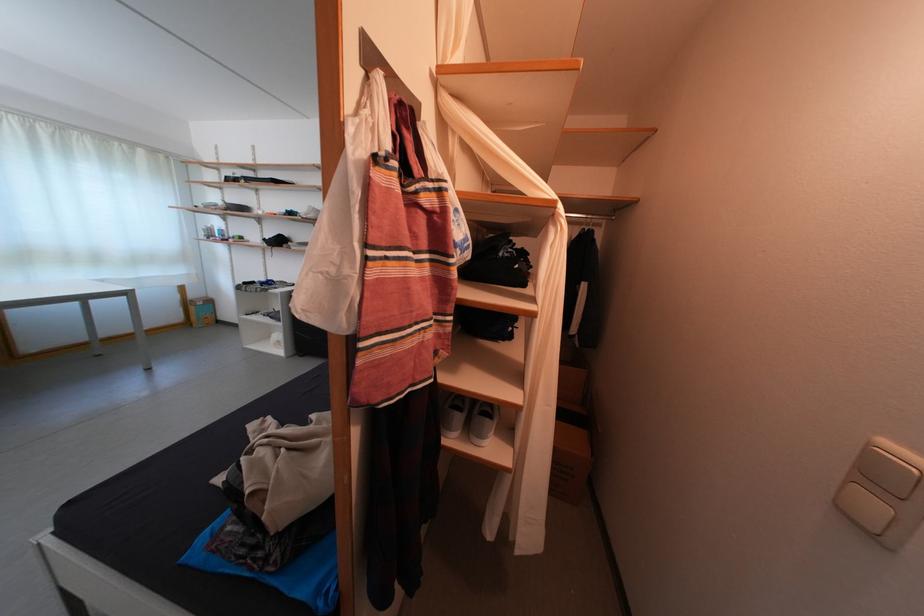
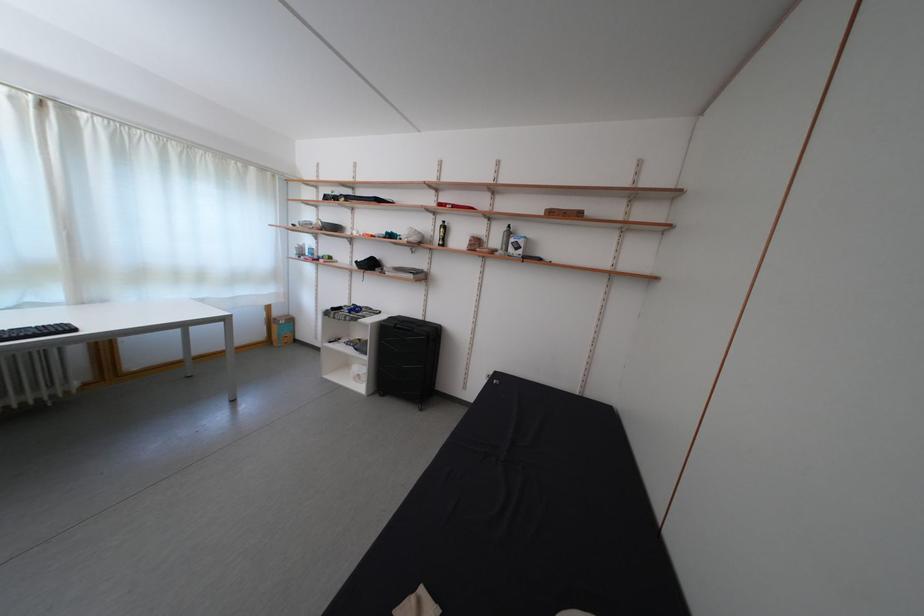
The point at (224, 203) is marked in the first image. Where is the corresponding point in the second image?

(319, 221)